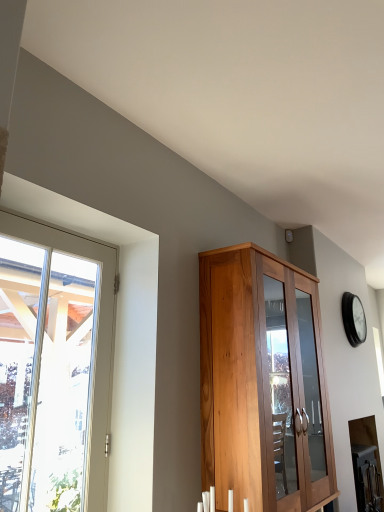
Question: Can you confirm if clear glass window at left is thinner than wooden cabinet at center?

Choices:
 (A) yes
 (B) no

Answer: (A)

Question: Is the position of clear glass window at left more distant than that of wooden cabinet at center?

Choices:
 (A) yes
 (B) no

Answer: (B)

Question: Is clear glass window at left placed right next to wooden cabinet at center?

Choices:
 (A) no
 (B) yes

Answer: (A)

Question: Is clear glass window at left far away from wooden cabinet at center?

Choices:
 (A) yes
 (B) no

Answer: (A)

Question: From a real-world perspective, is clear glass window at left located higher than wooden cabinet at center?

Choices:
 (A) yes
 (B) no

Answer: (A)

Question: Looking at the image, does black glass clock at upper right seem bigger or smaller compared to clear glass window at left?

Choices:
 (A) small
 (B) big

Answer: (A)

Question: Is black glass clock at upper right in front of or behind clear glass window at left in the image?

Choices:
 (A) behind
 (B) front

Answer: (A)

Question: Is black glass clock at upper right wider or thinner than clear glass window at left?

Choices:
 (A) thin
 (B) wide

Answer: (B)

Question: From the image's perspective, is black glass clock at upper right above or below clear glass window at left?

Choices:
 (A) below
 (B) above

Answer: (A)

Question: From a real-world perspective, is clear glass window at left physically located above or below wooden cabinet at center?

Choices:
 (A) below
 (B) above

Answer: (B)

Question: From the image's perspective, relative to wooden cabinet at center, is clear glass window at left above or below?

Choices:
 (A) above
 (B) below

Answer: (A)

Question: Do you think clear glass window at left is within wooden cabinet at center, or outside of it?

Choices:
 (A) outside
 (B) inside

Answer: (A)

Question: Looking at their shapes, would you say clear glass window at left is wider or thinner than wooden cabinet at center?

Choices:
 (A) wide
 (B) thin

Answer: (B)

Question: From a real-world perspective, relative to black glass clock at upper right, is clear glass window at left vertically above or below?

Choices:
 (A) below
 (B) above

Answer: (A)

Question: From their relative heights in the image, would you say clear glass window at left is taller or shorter than black glass clock at upper right?

Choices:
 (A) short
 (B) tall

Answer: (B)